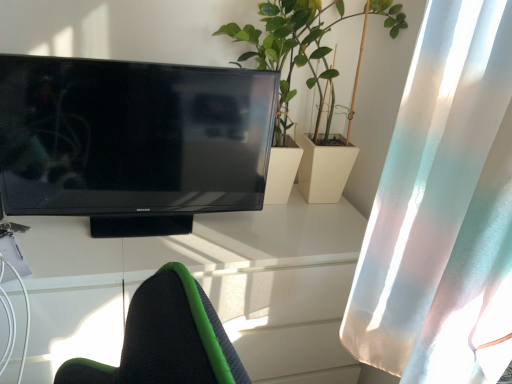
Locate an element on the screen. vacant space underneath matte black television at left (from a real-world perspective) is located at coordinates (153, 217).